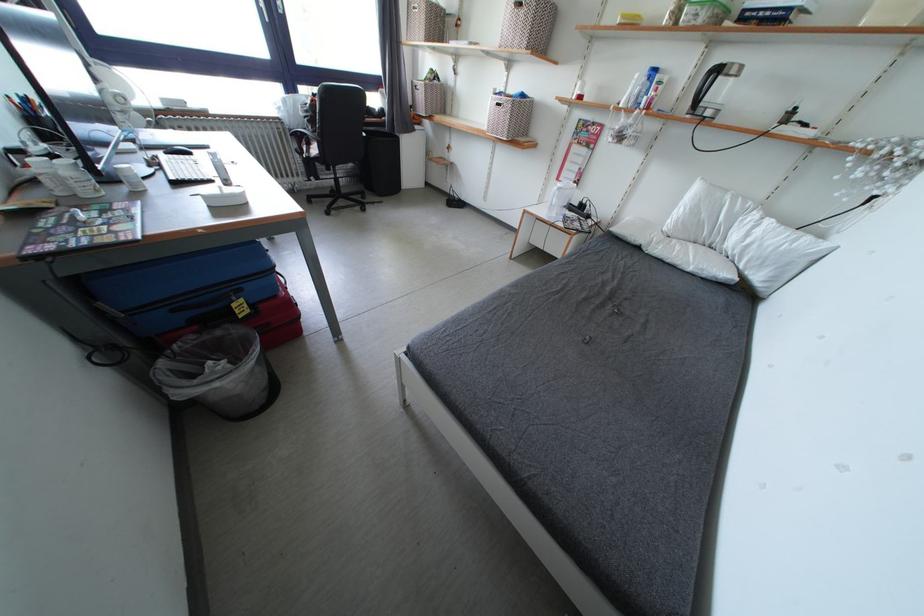
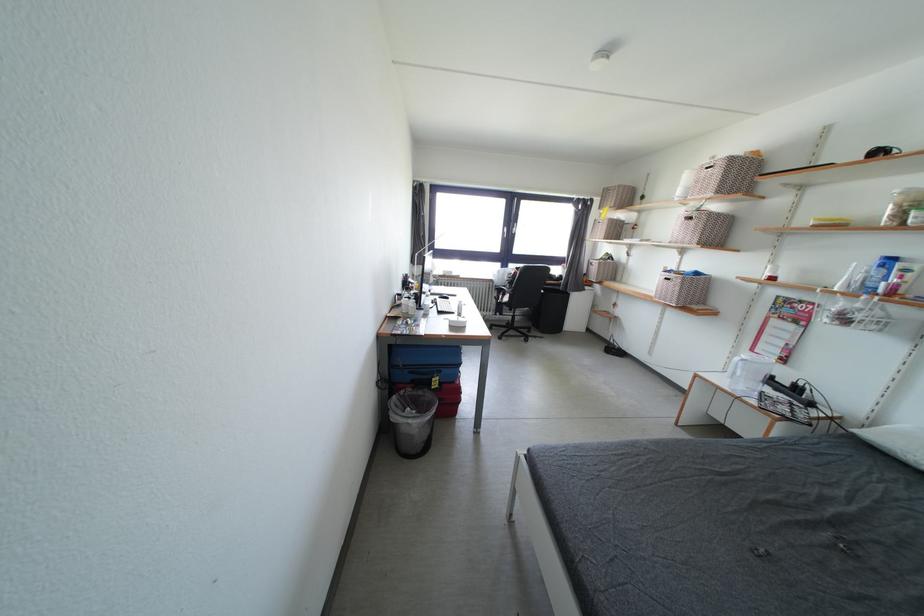
The point at [224,389] is marked in the first image. Where is the corresponding point in the second image?

(417, 426)